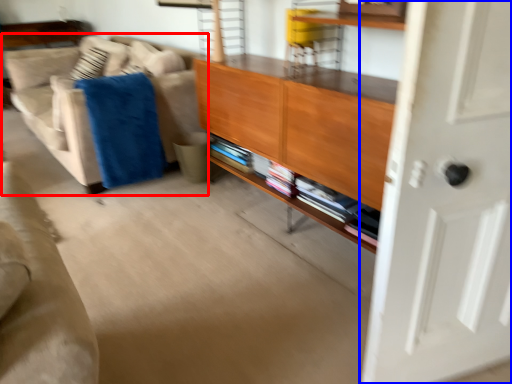
Question: Which object is closer to the camera taking this photo, studio couch (highlighted by a red box) or door (highlighted by a blue box)?

Choices:
 (A) studio couch
 (B) door

Answer: (B)